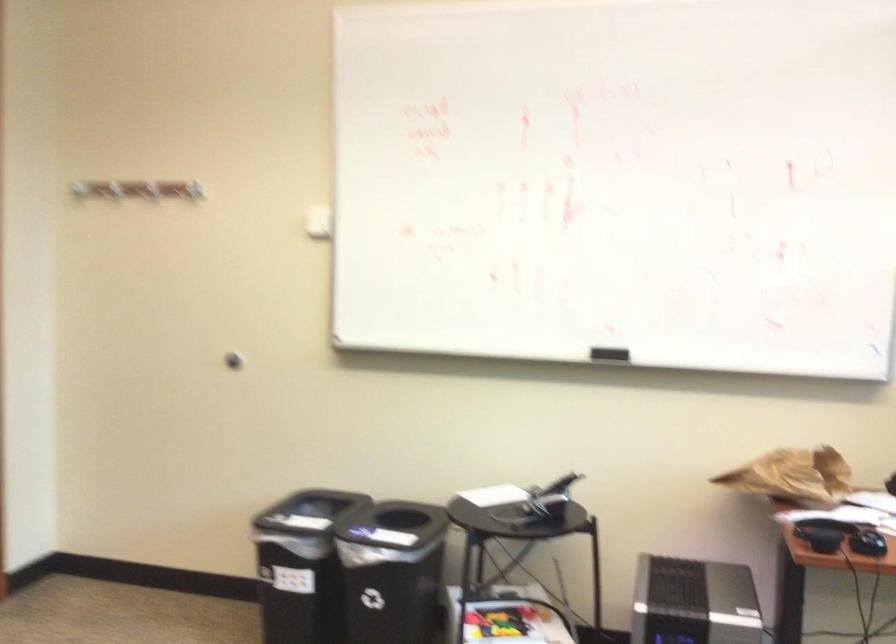
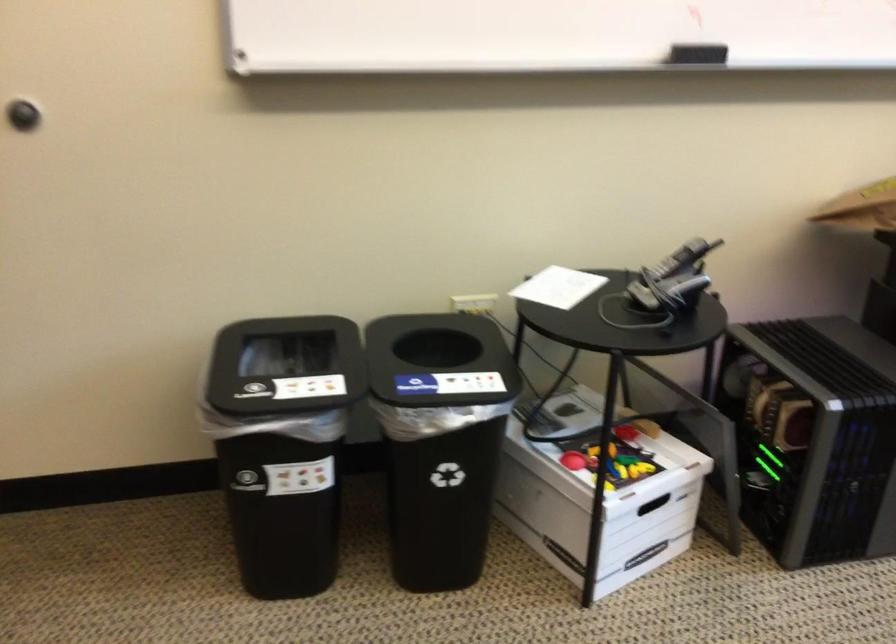
Locate, in the second image, the point that corresponds to point 495,498 in the first image.

(558, 287)